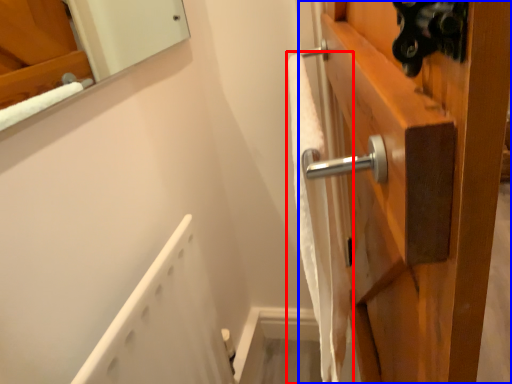
Question: Among these objects, which one is nearest to the camera, bath towel (highlighted by a red box) or door (highlighted by a blue box)?

Choices:
 (A) bath towel
 (B) door

Answer: (A)